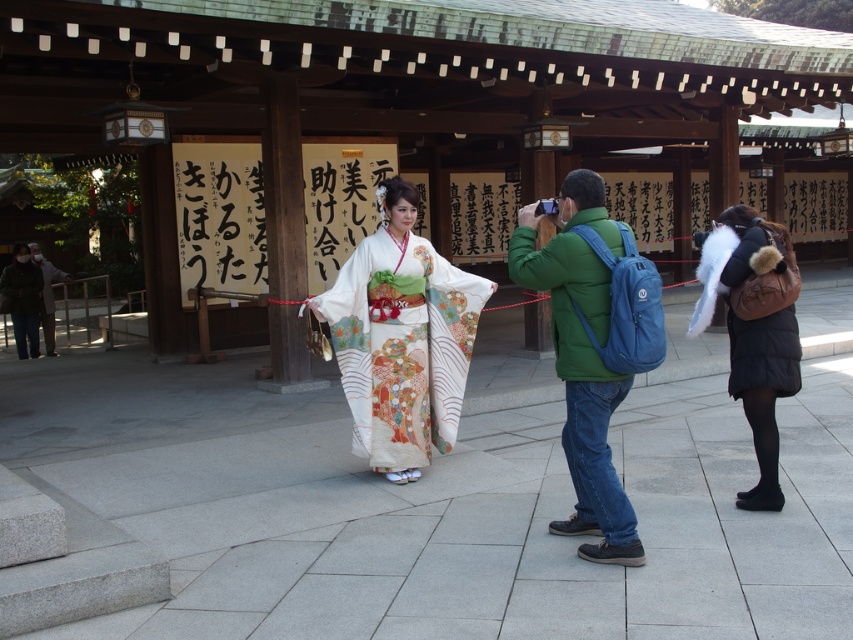
From the picture: Which is above, white silk kimono at center or dark gray fabric jacket at left?

dark gray fabric jacket at left is higher up.

What do you see at coordinates (401, 339) in the screenshot?
I see `white silk kimono at center` at bounding box center [401, 339].

Where is `white silk kimono at center`? white silk kimono at center is located at coordinates (401, 339).

Which is above, white silk kimono at center or green matte jacket at center?

white silk kimono at center is above.

You are a GUI agent. You are given a task and a screenshot of the screen. Output one action in this format:
    pyautogui.click(x=<x>, y=<y>)
    Task: Click on the white silk kimono at center
    
    Given the screenshot: What is the action you would take?
    pyautogui.click(x=401, y=339)

The image size is (853, 640). What do you see at coordinates (401, 339) in the screenshot?
I see `white silk kimono at center` at bounding box center [401, 339].

The image size is (853, 640). In order to click on white silk kimono at center in this screenshot , I will do `click(401, 339)`.

Between green matte jacket at center and brown fuzzy coat at lower right, which one has more height?

→ Standing taller between the two is green matte jacket at center.

Between point (624, 376) and point (735, 294), which one is positioned behind?

Point (735, 294)

The width and height of the screenshot is (853, 640). Find the location of `green matte jacket at center`. green matte jacket at center is located at coordinates (581, 362).